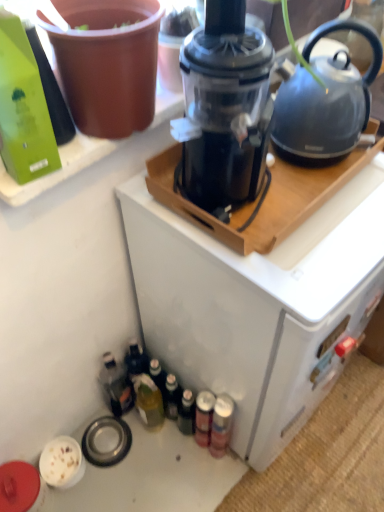
Question: Does matte gray kettle at upper right have a lesser height compared to translucent glass bottle at lower left, the 3th bottle in the top-to-bottom sequence?

Choices:
 (A) yes
 (B) no

Answer: (A)

Question: Is matte gray kettle at upper right positioned with its back to translucent glass bottle at lower left, which ranks as the first bottle in bottom-to-top order?

Choices:
 (A) yes
 (B) no

Answer: (B)

Question: From a real-world perspective, is matte gray kettle at upper right physically above translucent glass bottle at lower left, which ranks as the first bottle in bottom-to-top order?

Choices:
 (A) no
 (B) yes

Answer: (B)

Question: Can you confirm if matte gray kettle at upper right is positioned to the left of translucent glass bottle at lower left, which is counted as the 2th bottle, starting from the back?

Choices:
 (A) yes
 (B) no

Answer: (B)

Question: Considering the relative sizes of matte gray kettle at upper right and translucent glass bottle at lower left, the 3th bottle in the top-to-bottom sequence, in the image provided, is matte gray kettle at upper right wider than translucent glass bottle at lower left, the 3th bottle in the top-to-bottom sequence,?

Choices:
 (A) yes
 (B) no

Answer: (A)

Question: Is matte gray kettle at upper right next to translucent glass bottle at lower left, which is counted as the 2th bottle, starting from the back?

Choices:
 (A) yes
 (B) no

Answer: (B)

Question: Is green matte bottle at upper left, the first bottle in the top-to-bottom sequence, in contact with matte gray kettle at upper right?

Choices:
 (A) no
 (B) yes

Answer: (A)

Question: Could you tell me if green matte bottle at upper left, the third bottle when ordered from bottom to top, is turned towards matte gray kettle at upper right?

Choices:
 (A) no
 (B) yes

Answer: (A)

Question: Considering the relative positions of green matte bottle at upper left, the third bottle when ordered from bottom to top, and matte gray kettle at upper right in the image provided, is green matte bottle at upper left, the third bottle when ordered from bottom to top, to the right of matte gray kettle at upper right from the viewer's perspective?

Choices:
 (A) no
 (B) yes

Answer: (A)

Question: Is green matte bottle at upper left, the third bottle when ordered from bottom to top, far away from matte gray kettle at upper right?

Choices:
 (A) no
 (B) yes

Answer: (A)

Question: Is green matte bottle at upper left, the third bottle when ordered from bottom to top, thinner than matte gray kettle at upper right?

Choices:
 (A) yes
 (B) no

Answer: (A)

Question: Can you confirm if green matte bottle at upper left, the third bottle positioned from the back, is taller than matte gray kettle at upper right?

Choices:
 (A) yes
 (B) no

Answer: (B)

Question: Does matte gray kettle at upper right have a larger size compared to green matte bottle at upper left, which appears as the first bottle when viewed from the front?

Choices:
 (A) no
 (B) yes

Answer: (B)